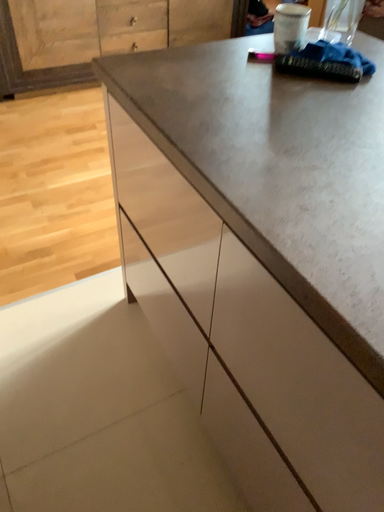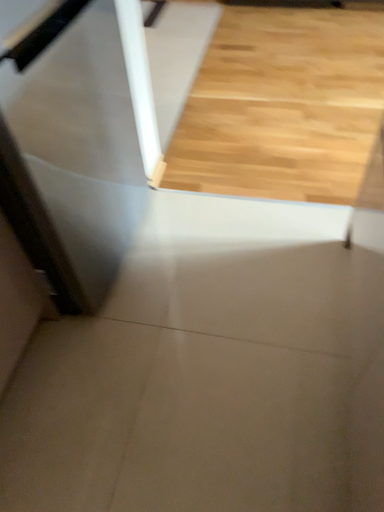
Question: How did the camera likely rotate when shooting the video?

Choices:
 (A) rotated left
 (B) rotated right

Answer: (A)